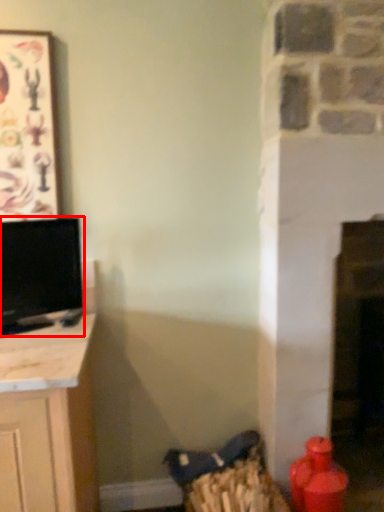
Question: From the image's perspective, where is television (annotated by the red box) located in relation to picture frame in the image?

Choices:
 (A) below
 (B) above

Answer: (A)